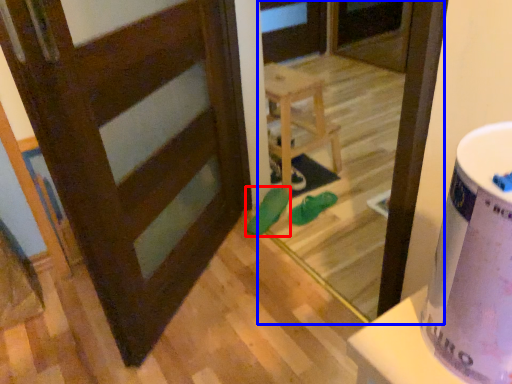
Question: Which object appears closest to the camera in this image, footwear (highlighted by a red box) or screen door (highlighted by a blue box)?

Choices:
 (A) footwear
 (B) screen door

Answer: (B)